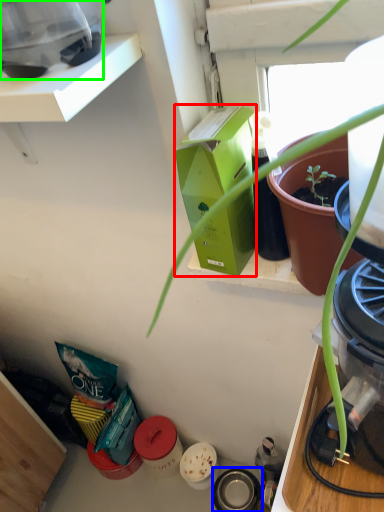
Question: Which is nearer to the box (highlighted by a red box)? appliance (highlighted by a blue box) or appliance (highlighted by a green box).

Choices:
 (A) appliance
 (B) appliance

Answer: (B)